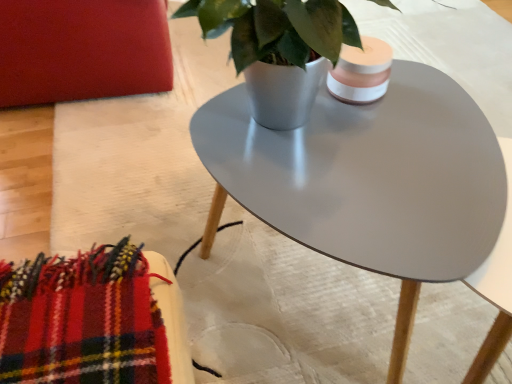
Identify the location of blank space situated above matte gray coffee table at center (from a real-world perspective). (369, 154).